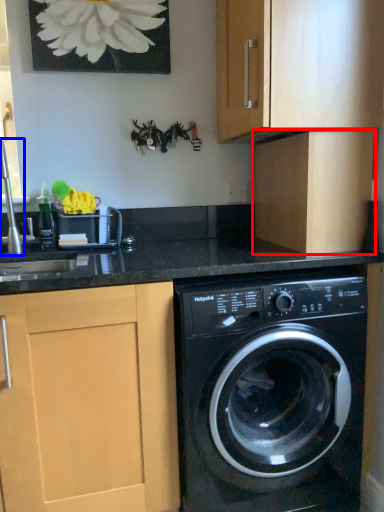
Question: Among these objects, which one is farthest to the camera, cabinetry (highlighted by a red box) or faucet (highlighted by a blue box)?

Choices:
 (A) cabinetry
 (B) faucet

Answer: (A)